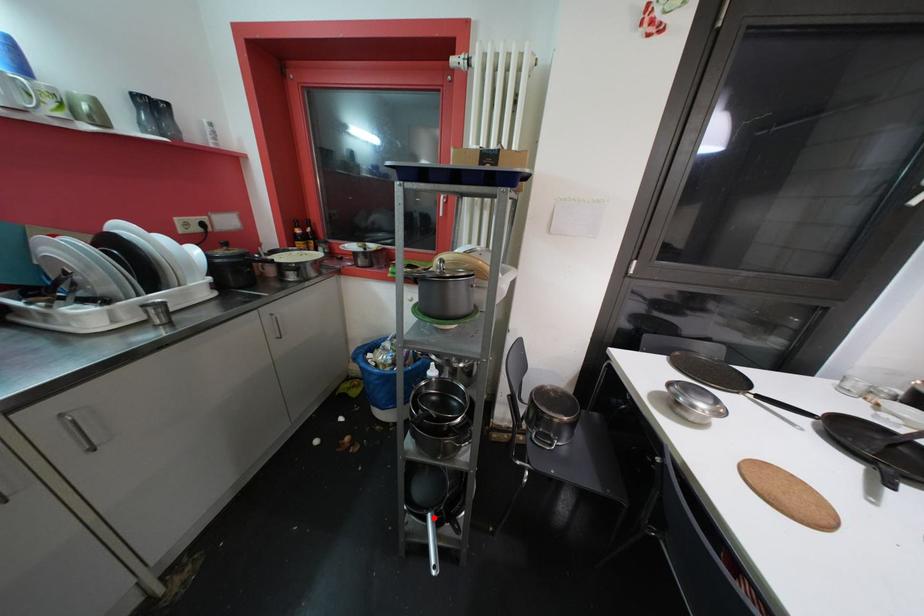
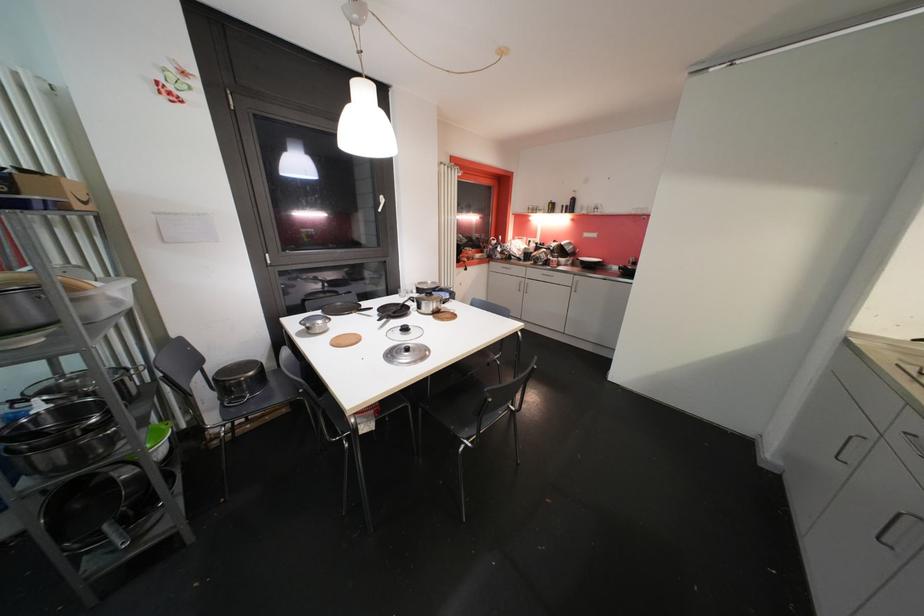
Question: I am providing you with two images of the same scene from different viewpoints. Image1 has a red point marked. In image2, the corresponding 3D location appears at what relative position? Reply with the corresponding letter.

Choices:
 (A) Closer
 (B) Farther

Answer: (A)